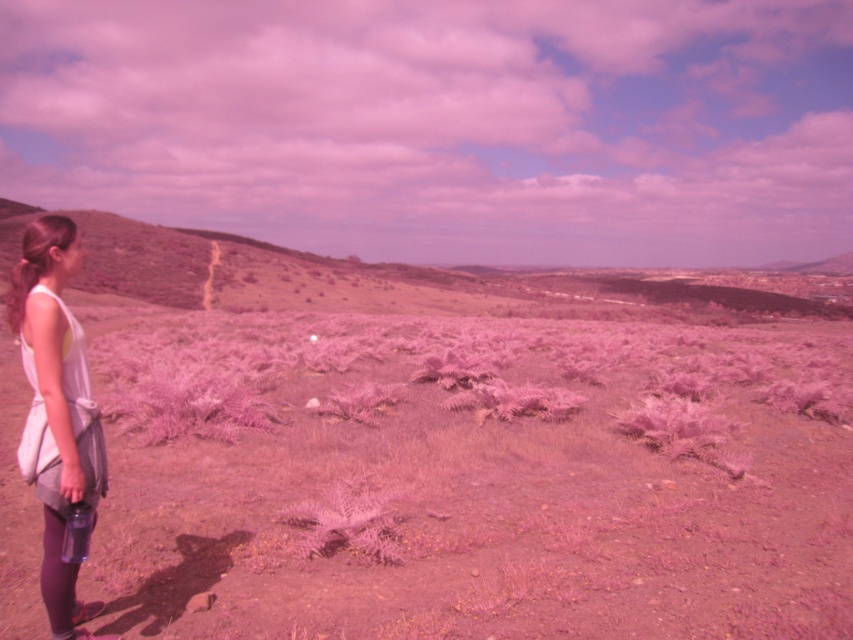
What do you see at coordinates (492, 493) in the screenshot? The width and height of the screenshot is (853, 640). I see `dusty pink dirt field at center` at bounding box center [492, 493].

Can you confirm if dusty pink dirt field at center is positioned to the right of blonde hair at left?

Indeed, dusty pink dirt field at center is positioned on the right side of blonde hair at left.

Is point (569, 605) positioned behind point (19, 292)?

That is True.

I want to click on dusty pink dirt field at center, so click(x=492, y=493).

Is dried grass at upper left further to the viewer compared to white fabric dress at left?

Yes, it is behind white fabric dress at left.

Which is below, dried grass at upper left or white fabric dress at left?

white fabric dress at left is lower down.

Who is more distant from viewer, (550, 310) or (51, 592)?

Point (550, 310)

Where is `dried grass at upper left`? The height and width of the screenshot is (640, 853). dried grass at upper left is located at coordinates (407, 280).

What do you see at coordinates (492, 493) in the screenshot? I see `dusty pink dirt field at center` at bounding box center [492, 493].

Can you confirm if dusty pink dirt field at center is smaller than dried grass at upper left?

Yes.

Image resolution: width=853 pixels, height=640 pixels. Identify the location of dusty pink dirt field at center. (492, 493).

Identify the location of dusty pink dirt field at center. (492, 493).